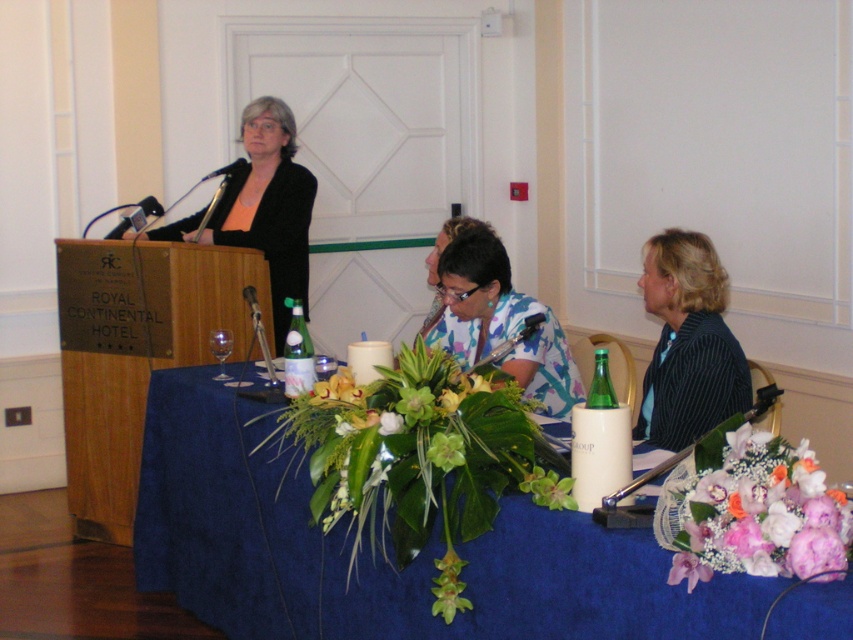
Does green leafy plant at center have a smaller size compared to floral print shirt at center?

Actually, green leafy plant at center might be larger than floral print shirt at center.

Can you confirm if green leafy plant at center is taller than floral print shirt at center?

Incorrect, green leafy plant at center's height is not larger of floral print shirt at center's.

Image resolution: width=853 pixels, height=640 pixels. What do you see at coordinates (421, 458) in the screenshot?
I see `green leafy plant at center` at bounding box center [421, 458].

Locate an element on the screen. The image size is (853, 640). green leafy plant at center is located at coordinates click(x=421, y=458).

Is point (714, 486) in front of point (462, 337)?

Yes, it is.

How distant is purple silk flowers at center from floral print shirt at center?

A distance of 4.65 feet exists between purple silk flowers at center and floral print shirt at center.

Which is in front, point (834, 497) or point (503, 298)?

Point (834, 497)

Identify the location of purple silk flowers at center. (756, 513).

Does blue fabric table at center come behind green leafy plant at center?

No, it is not.

Between point (674, 589) and point (403, 554), which one is positioned in front?

Point (674, 589) is more forward.

Where is `blue fabric table at center`? This screenshot has width=853, height=640. blue fabric table at center is located at coordinates (380, 556).